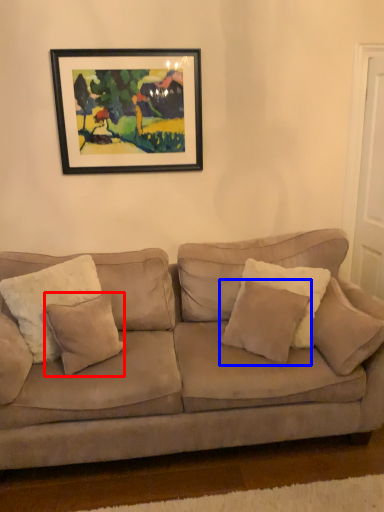
Question: Which object is further to the camera taking this photo, pillow (highlighted by a red box) or pillow (highlighted by a blue box)?

Choices:
 (A) pillow
 (B) pillow

Answer: (A)